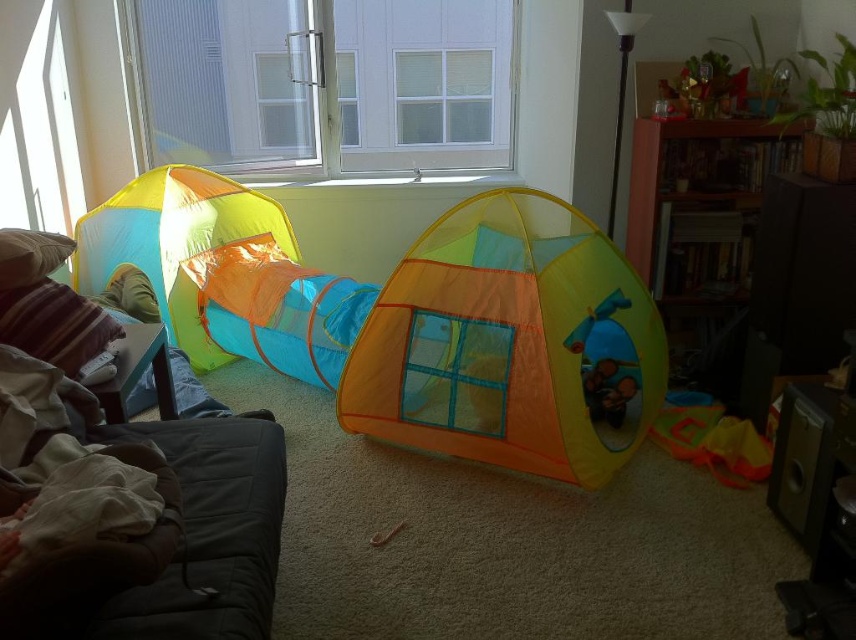
You are standing in the living room and want to place a new floor lamp. The lamp requires a space that is at least 2 meters away from the viewer to avoid blocking the view of the window. Is the point at coordinates point (147, 241) suitable for placing the lamp?

The point at coordinates point (147, 241) is 3.03 meters away from the viewer, which is more than the required 2 meters. Therefore, placing the lamp there would be suitable as it meets the distance requirement.

You are a parent setting up a play area and want to place a new toy box between the translucent nylon tent at center and the wooden bookshelf on the right. Based on their positions, can you determine if there is enough space between them to fit the toy box?

The translucent nylon tent at center is located at point (510, 342). Since the wooden bookshelf is on the right, the distance between them would need to be calculated to determine if the toy box fits, but without specific measurements, it cannot be confirmed.

You are a parent trying to set up two play tents for your children. The translucent nylon tent at center and the translucent orange fabric play tent at center are both on the carpeted floor. Which tent requires more horizontal space to fully unfold its structure?

The translucent nylon tent at center requires more horizontal space to fully unfold its structure because its width surpasses that of the translucent orange fabric play tent at center.